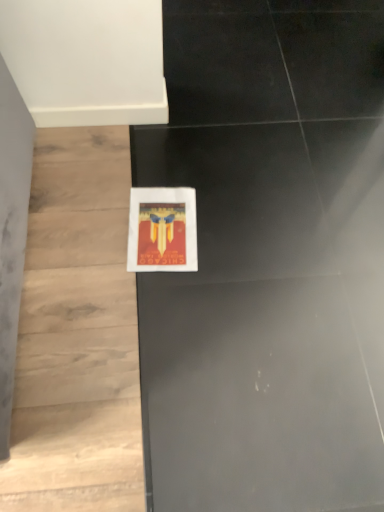
Where is `empty space that is to the right of matte paper picture frame at center`? empty space that is to the right of matte paper picture frame at center is located at coordinates (232, 237).